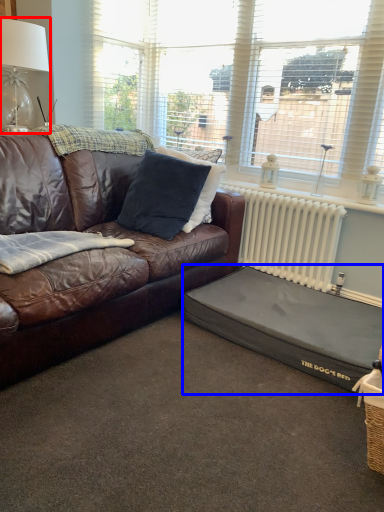
Question: Among these objects, which one is farthest to the camera, table lamp (highlighted by a red box) or footrest (highlighted by a blue box)?

Choices:
 (A) table lamp
 (B) footrest

Answer: (A)